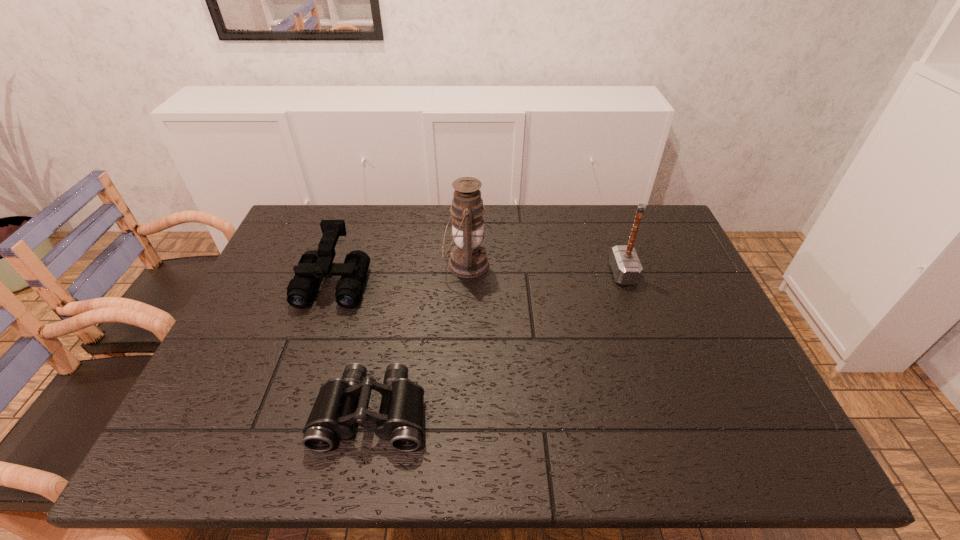
Image resolution: width=960 pixels, height=540 pixels. Find the location of `free space at the near right corner of the desktop`. free space at the near right corner of the desktop is located at coordinates (713, 445).

Locate an element on the screen. The width and height of the screenshot is (960, 540). free space between the hammer and the shorter binoculars is located at coordinates (497, 343).

The width and height of the screenshot is (960, 540). Identify the location of empty location between the shortest object and the tallest object. (420, 338).

At what (x,y) coordinates should I click in order to perform the action: click on empty space between the shorter binoculars and the farther binoculars. Please return your answer as a coordinate pair (x, y). This screenshot has height=540, width=960. Looking at the image, I should click on (353, 347).

This screenshot has height=540, width=960. Identify the location of vacant space in between the shorter binoculars and the hammer. (497, 343).

The width and height of the screenshot is (960, 540). Identify the location of free space between the shorter binoculars and the farther binoculars. (353, 347).

Identify the location of vacant area that lies between the farther binoculars and the nearer binoculars. (353, 347).

Image resolution: width=960 pixels, height=540 pixels. I want to click on free space between the nearer binoculars and the tallest object, so click(420, 338).

The width and height of the screenshot is (960, 540). In order to click on unoccupied area between the second object from right to left and the nearer binoculars in this screenshot , I will do coord(420,338).

Find the location of `free space between the taller binoculars and the hammer`. free space between the taller binoculars and the hammer is located at coordinates (478, 278).